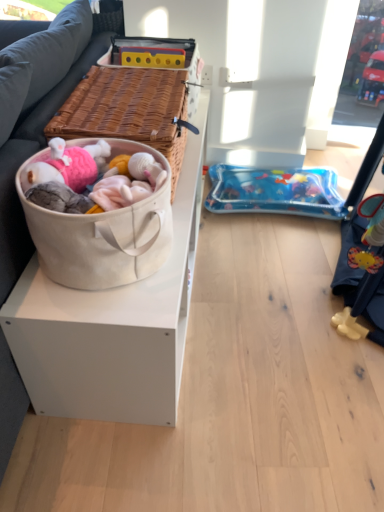
Question: From a real-world perspective, is beige canvas basket at left located beneath dark gray fabric couch at left?

Choices:
 (A) yes
 (B) no

Answer: (B)

Question: Is beige canvas basket at left oriented towards dark gray fabric couch at left?

Choices:
 (A) yes
 (B) no

Answer: (B)

Question: Is beige canvas basket at left positioned far away from dark gray fabric couch at left?

Choices:
 (A) yes
 (B) no

Answer: (B)

Question: From the image's perspective, does beige canvas basket at left appear lower than dark gray fabric couch at left?

Choices:
 (A) yes
 (B) no

Answer: (A)

Question: Is dark gray fabric couch at left at the back of beige canvas basket at left?

Choices:
 (A) yes
 (B) no

Answer: (A)

Question: Is beige canvas basket at left at the right side of dark gray fabric couch at left?

Choices:
 (A) no
 (B) yes

Answer: (B)

Question: Considering the relative sizes of blue inflatable mattress at lower right and dark gray fabric couch at left in the image provided, is blue inflatable mattress at lower right shorter than dark gray fabric couch at left?

Choices:
 (A) no
 (B) yes

Answer: (B)

Question: Can we say blue inflatable mattress at lower right lies outside dark gray fabric couch at left?

Choices:
 (A) yes
 (B) no

Answer: (A)

Question: Are blue inflatable mattress at lower right and dark gray fabric couch at left located far from each other?

Choices:
 (A) no
 (B) yes

Answer: (A)

Question: Can you confirm if blue inflatable mattress at lower right is positioned to the right of dark gray fabric couch at left?

Choices:
 (A) no
 (B) yes

Answer: (B)

Question: From a real-world perspective, is blue inflatable mattress at lower right positioned over dark gray fabric couch at left based on gravity?

Choices:
 (A) no
 (B) yes

Answer: (A)

Question: Considering the relative sizes of blue inflatable mattress at lower right and dark gray fabric couch at left in the image provided, is blue inflatable mattress at lower right smaller than dark gray fabric couch at left?

Choices:
 (A) no
 (B) yes

Answer: (B)

Question: Is blue inflatable mattress at lower right to the right of beige canvas basket at left from the viewer's perspective?

Choices:
 (A) no
 (B) yes

Answer: (B)